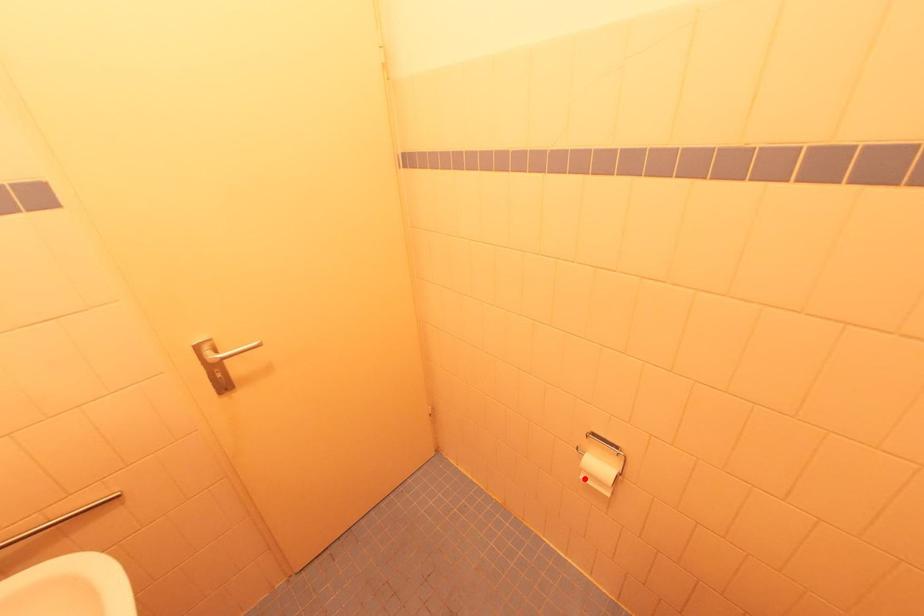
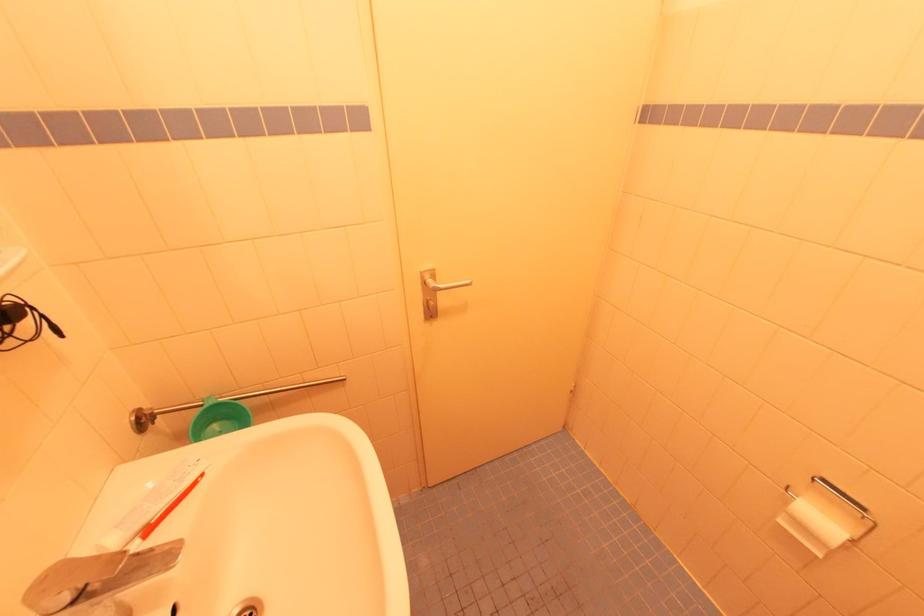
Question: I am providing you with two images of the same scene from different viewpoints. Image1 has a red point marked. In image2, the corresponding 3D location appears at what relative position? Reply with the corresponding letter.

Choices:
 (A) Closer
 (B) Farther

Answer: (A)